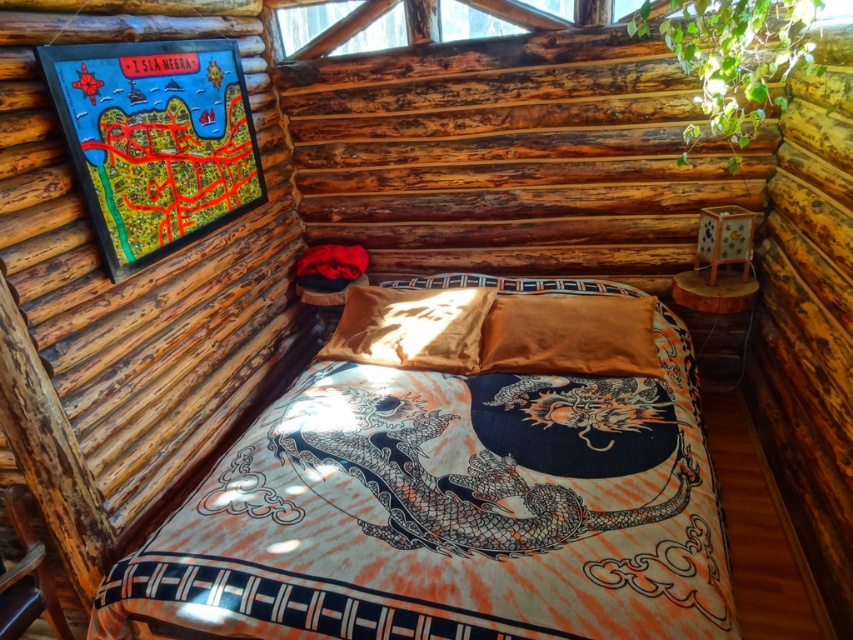
Question: Can you confirm if silky cotton bed at center is positioned below satin gold pillow at center?

Choices:
 (A) no
 (B) yes

Answer: (B)

Question: Does silky cotton bed at center have a smaller size compared to satin orange pillow at center?

Choices:
 (A) yes
 (B) no

Answer: (B)

Question: Among these objects, which one is farthest from the camera?

Choices:
 (A) silky cotton bed at center
 (B) satin orange pillow at center

Answer: (B)

Question: Is silky cotton bed at center below satin gold pillow at center?

Choices:
 (A) yes
 (B) no

Answer: (A)

Question: Estimate the real-world distances between objects in this image. Which object is farther from the satin orange pillow at center?

Choices:
 (A) satin gold pillow at center
 (B) silky cotton bed at center

Answer: (B)

Question: Which object is farther from the camera taking this photo?

Choices:
 (A) satin orange pillow at center
 (B) satin gold pillow at center

Answer: (B)